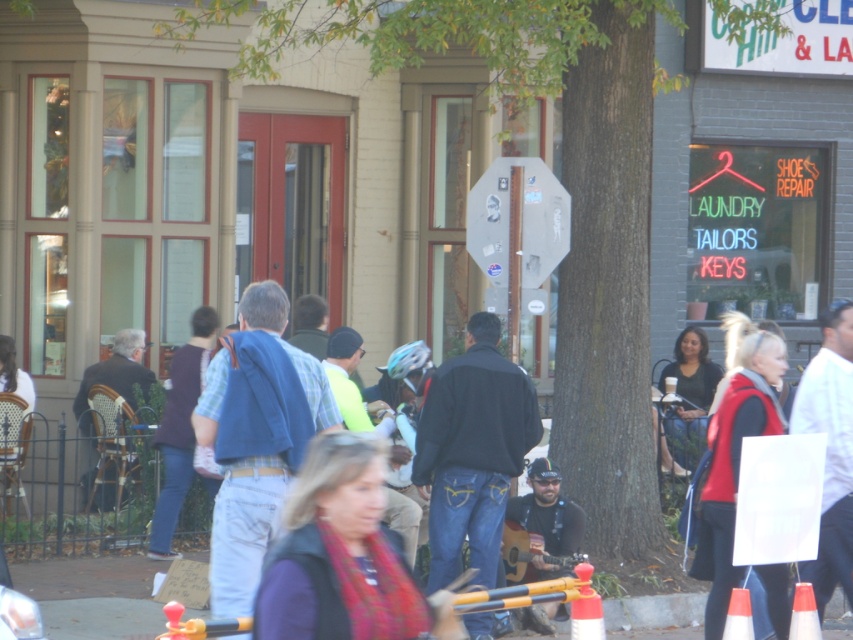
Question: Can you confirm if black matte jacket at center is smaller than orange plastic cone at lower right?

Choices:
 (A) yes
 (B) no

Answer: (B)

Question: Considering the relative positions of matte blue jeans at left and dark brown leather jacket at left in the image provided, where is matte blue jeans at left located with respect to dark brown leather jacket at left?

Choices:
 (A) left
 (B) right

Answer: (B)

Question: Which object is farther from the camera taking this photo?

Choices:
 (A) purple matte vest at center
 (B) white plastic cone at lower center

Answer: (B)

Question: Is black matte jacket at center below dark brown leather jacket at left?

Choices:
 (A) yes
 (B) no

Answer: (A)

Question: Which object is positioned farthest from the dark brown leather jacket at left?

Choices:
 (A) purple matte vest at center
 (B) white paper sign at center
 (C) white plastic cone at lower right
 (D) matte black guitar at center

Answer: (A)

Question: Among these points, which one is farthest from the camera?

Choices:
 (A) (83, 397)
 (B) (758, 394)

Answer: (A)